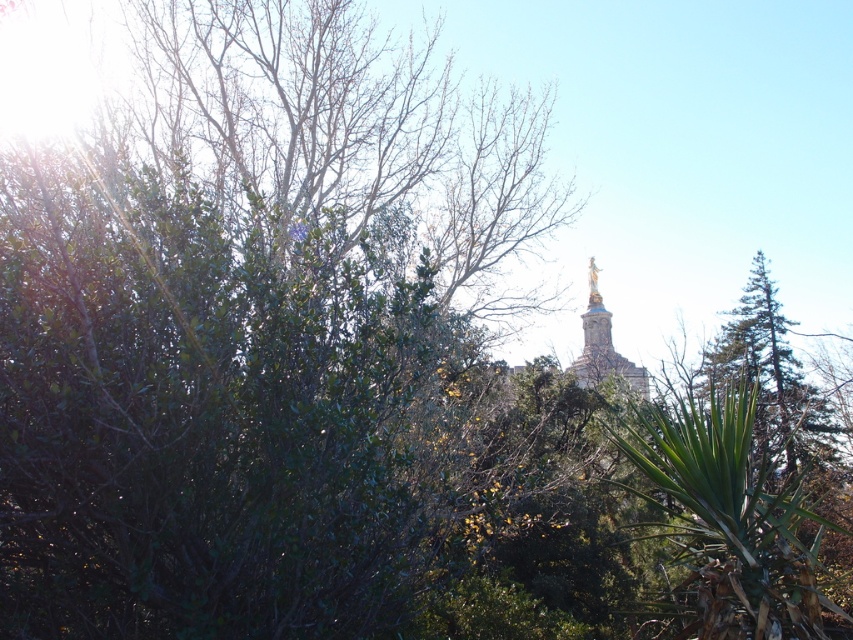
You are a landscape architect designing a garden. You have to place a new bench between the green leafy tree at right and the gold statue at center. Which object should the bench be closer to to ensure it is not overshadowed by the larger structure?

The bench should be placed closer to the green leafy tree at right because the gold statue at center is larger and could overshadow the bench if placed too close.

From the picture: You are standing at the point marked as point (769, 344) in the image. A friend is located 115.70 meters away from you. In which direction should your friend move to get closer to the dome roof structure in the background?

The friend should move towards the dome roof structure in the background, which is located in the direction opposite to the dense greenery in the foreground. Since the friend is 115.70 meters away from point (769, 344), moving towards the background would bring them closer to the dome.

You are a photographer setting up a tripod in this outdoor scene. You want to capture both the green leafy tree at right and the gold statue at center in your shot. Which object should you position closer to the front of your frame to ensure both are fully visible?

Since the green leafy tree at right is taller than the gold statue at center, you should position the gold statue at center closer to the front of your frame. This way, the taller tree at the back won